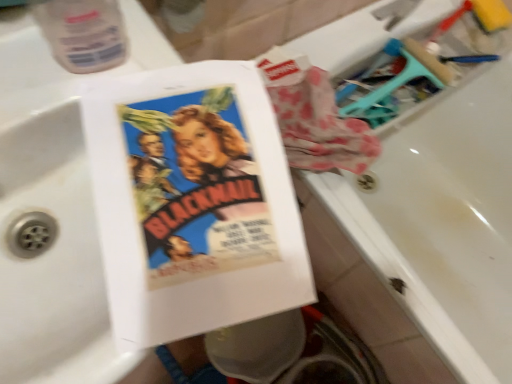
Question: Is matte paper book at center touching transparent plastic bottle at upper left?

Choices:
 (A) yes
 (B) no

Answer: (B)

Question: From the image's perspective, does matte paper book at center appear higher than transparent plastic bottle at upper left?

Choices:
 (A) yes
 (B) no

Answer: (B)

Question: Is matte paper book at center smaller than transparent plastic bottle at upper left?

Choices:
 (A) no
 (B) yes

Answer: (A)

Question: Does matte paper book at center turn towards transparent plastic bottle at upper left?

Choices:
 (A) yes
 (B) no

Answer: (B)

Question: Is there a large distance between matte paper book at center and transparent plastic bottle at upper left?

Choices:
 (A) no
 (B) yes

Answer: (A)

Question: From the image's perspective, is matte paper book at center below transparent plastic bottle at upper left?

Choices:
 (A) yes
 (B) no

Answer: (A)

Question: Is white glossy bathtub at upper right positioned beyond the bounds of matte paper book at center?

Choices:
 (A) yes
 (B) no

Answer: (A)

Question: From a real-world perspective, is white glossy bathtub at upper right on matte paper book at center?

Choices:
 (A) no
 (B) yes

Answer: (A)

Question: Considering the relative sizes of white glossy bathtub at upper right and matte paper book at center in the image provided, is white glossy bathtub at upper right bigger than matte paper book at center?

Choices:
 (A) no
 (B) yes

Answer: (B)

Question: Considering the relative sizes of white glossy bathtub at upper right and matte paper book at center in the image provided, is white glossy bathtub at upper right thinner than matte paper book at center?

Choices:
 (A) yes
 (B) no

Answer: (B)

Question: Can you see white glossy bathtub at upper right touching matte paper book at center?

Choices:
 (A) yes
 (B) no

Answer: (B)

Question: Is white glossy bathtub at upper right to the right of matte paper book at center from the viewer's perspective?

Choices:
 (A) no
 (B) yes

Answer: (B)

Question: Is white glossy bathtub at upper right taller than transparent plastic bottle at upper left?

Choices:
 (A) yes
 (B) no

Answer: (A)